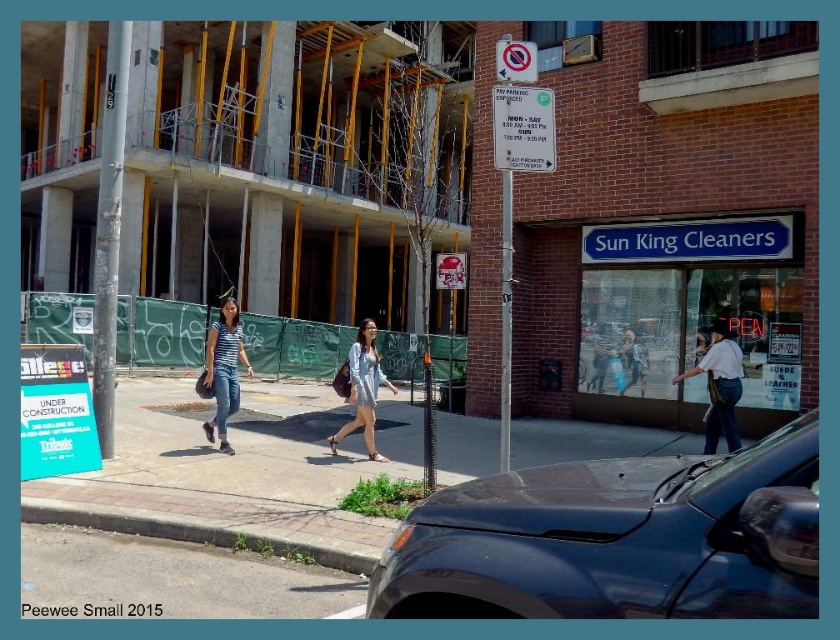
Question: Can you confirm if glossy black car at lower right is thinner than striped cotton shirt at center?

Choices:
 (A) no
 (B) yes

Answer: (B)

Question: Which point is farther from the camera taking this photo?

Choices:
 (A) (360, 403)
 (B) (809, 452)
 (C) (234, 356)
 (D) (242, 582)

Answer: (C)

Question: From the image, what is the correct spatial relationship of white cotton shirt at center in relation to striped cotton shirt at center?

Choices:
 (A) right
 (B) left

Answer: (A)

Question: Which object is farther from the camera taking this photo?

Choices:
 (A) matte blue dress at center
 (B) striped cotton shirt at center
 (C) white cotton shirt at center

Answer: (B)

Question: Which point appears closest to the camera in this image?

Choices:
 (A) (219, 573)
 (B) (365, 340)
 (C) (712, 449)

Answer: (A)

Question: Does white cotton shirt at center come behind striped cotton shirt at center?

Choices:
 (A) yes
 (B) no

Answer: (B)